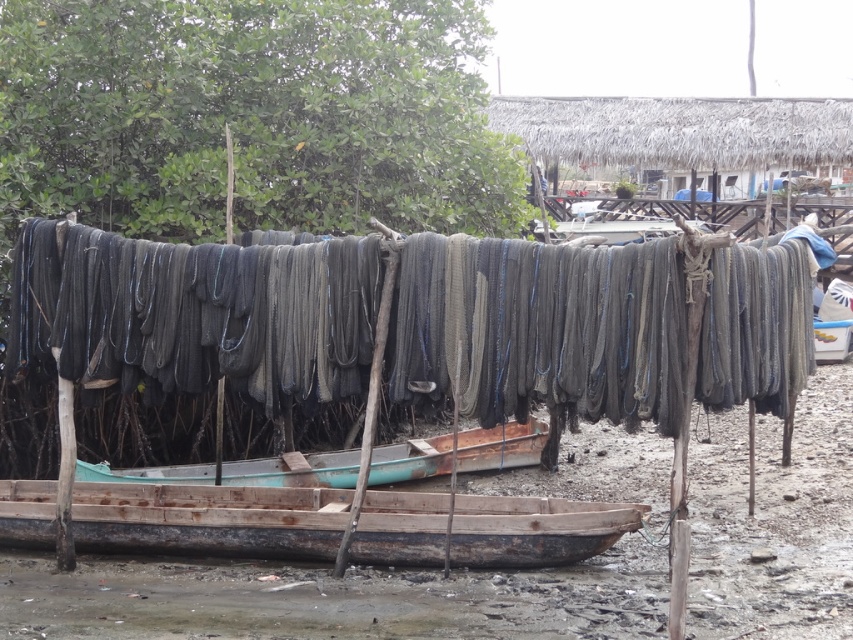
Question: Does rusty wooden boat at center appear on the left side of teal wooden canoe at center?

Choices:
 (A) no
 (B) yes

Answer: (A)

Question: Which of the following is the closest to the observer?

Choices:
 (A) teal wooden canoe at center
 (B) rusty wooden boat at center

Answer: (B)

Question: Is rusty wood canoe at center positioned before teal wooden canoe at center?

Choices:
 (A) no
 (B) yes

Answer: (B)

Question: Which of these objects is positioned closest to the rusty wooden boat at center?

Choices:
 (A) dark gray netting at center
 (B) rusty wood canoe at center

Answer: (B)

Question: Is dark gray netting at center in front of rusty wood canoe at center?

Choices:
 (A) no
 (B) yes

Answer: (B)

Question: Which point is farther from the camera taking this photo?

Choices:
 (A) (543, 436)
 (B) (190, 632)
 (C) (61, 362)
 (D) (502, 552)

Answer: (A)